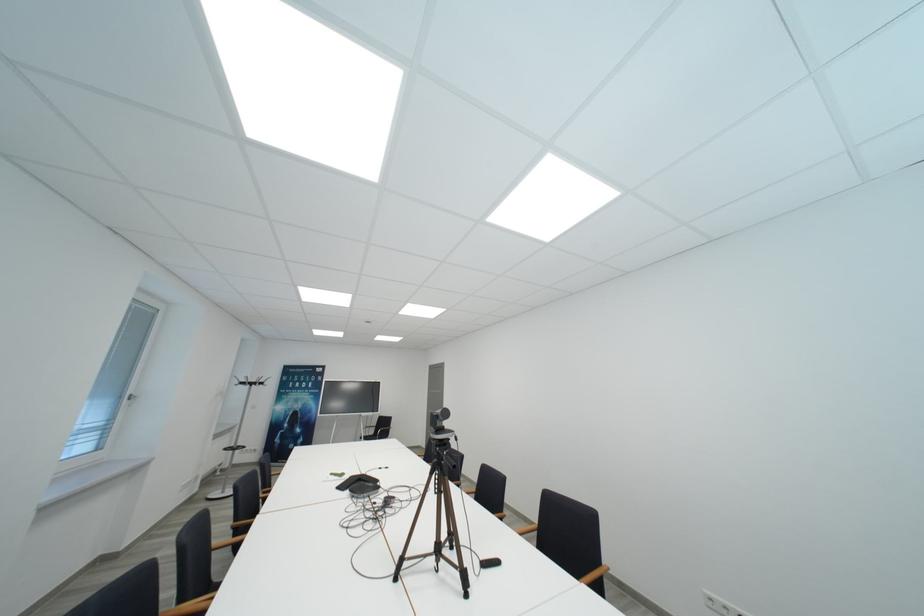
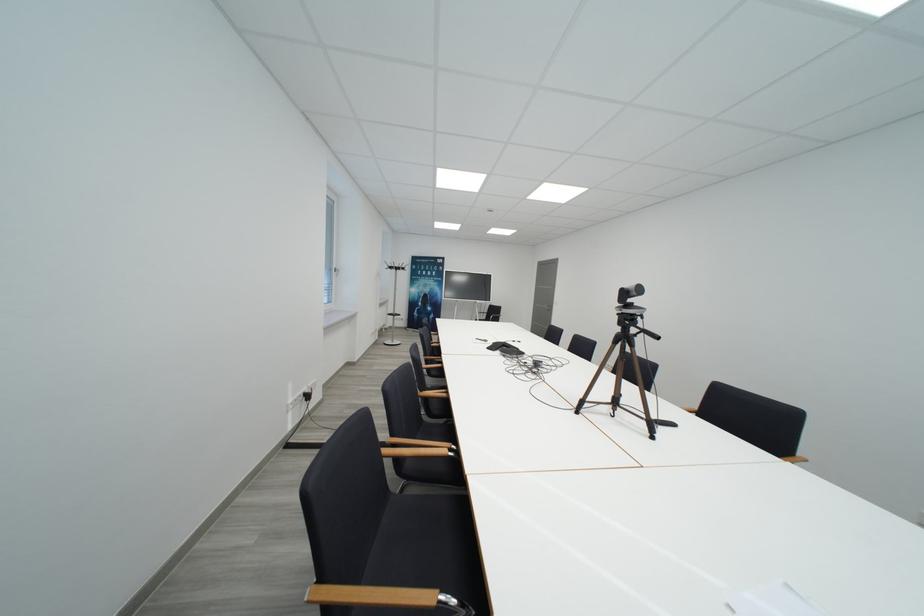
In the second image, find the point that corresponds to (x=128, y=400) in the first image.

(337, 273)